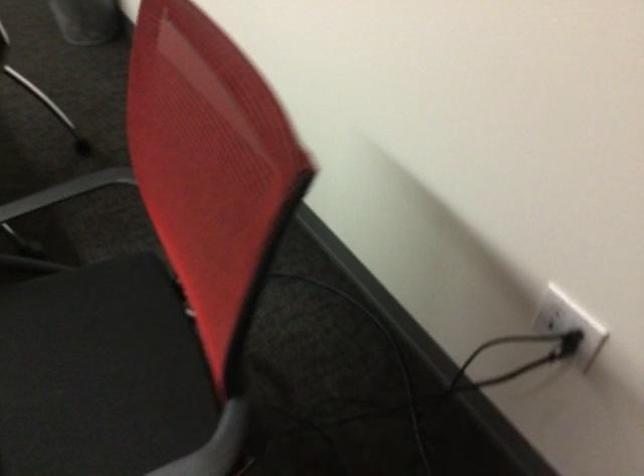
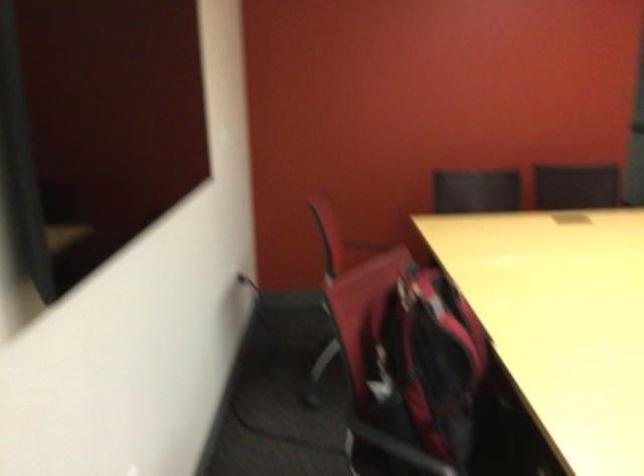
Question: I am providing you with two images of the same scene from different viewpoints. Please identify which objects are invisible in image2.

Choices:
 (A) purple pump dispenser
 (B) black chair armrest
 (C) chair sitting surface
 (D) red and black backpack

Answer: (C)